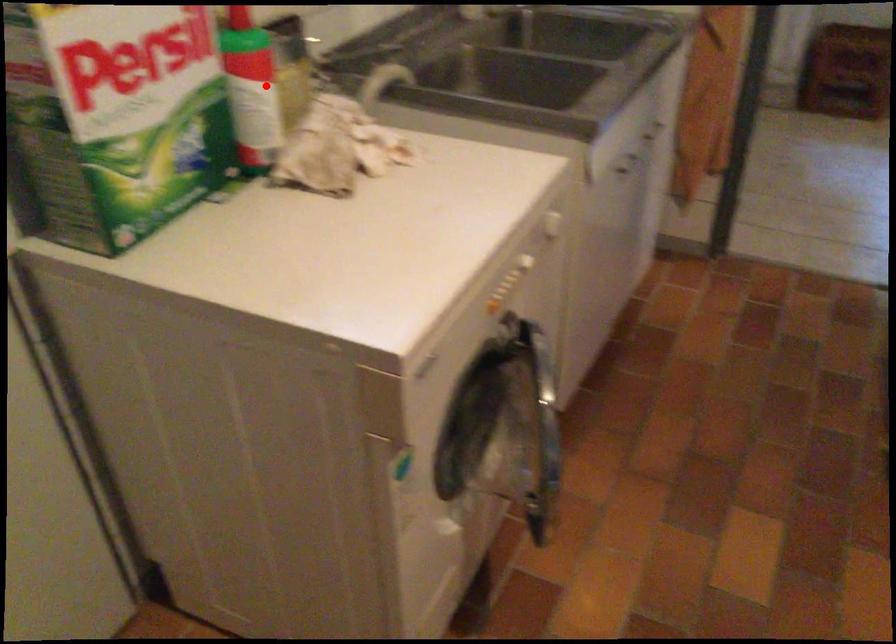
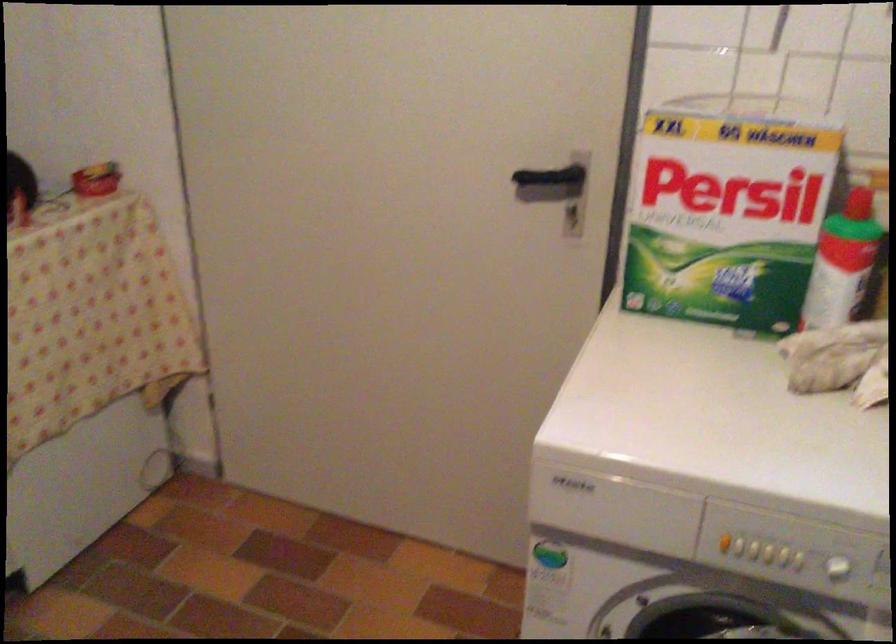
Locate, in the second image, the point that corresponds to the highlighted location in the first image.

(842, 263)